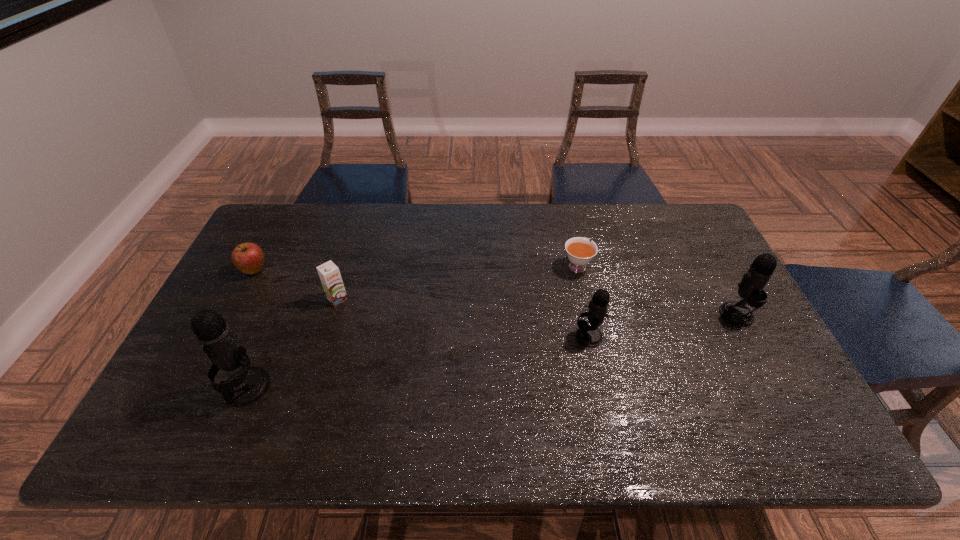
Where is `microphone that is at the left edge`? The height and width of the screenshot is (540, 960). microphone that is at the left edge is located at coordinates (247, 385).

The height and width of the screenshot is (540, 960). What are the coordinates of `apple situated at the left edge` in the screenshot? It's located at (248, 257).

Identify the location of object that is at the right edge. The width and height of the screenshot is (960, 540). (751, 287).

Where is `object situated at the near left corner`? object situated at the near left corner is located at coordinates (247, 385).

You are a GUI agent. You are given a task and a screenshot of the screen. Output one action in this format:
    pyautogui.click(x=<x>, y=<y>)
    Task: Click on the free space at the far edge of the desktop
    This screenshot has width=960, height=540.
    Given the screenshot: What is the action you would take?
    pyautogui.click(x=347, y=205)

The height and width of the screenshot is (540, 960). Find the location of `free space at the near edge`. free space at the near edge is located at coordinates (x=488, y=392).

In the image, there is a desktop. Identify the location of vacant space at the left edge. (237, 275).

I want to click on vacant region at the right edge of the desktop, so pyautogui.click(x=688, y=262).

This screenshot has height=540, width=960. Identify the location of free spot between the fifth tallest object and the second microphone from left to right. (421, 303).

Locate an element on the screen. free space between the fourth tallest object and the second microphone from left to right is located at coordinates (463, 318).